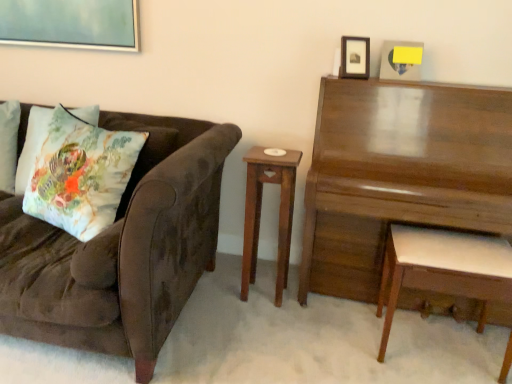
I want to click on spots to the right of wooden nightstand at center, so click(308, 305).